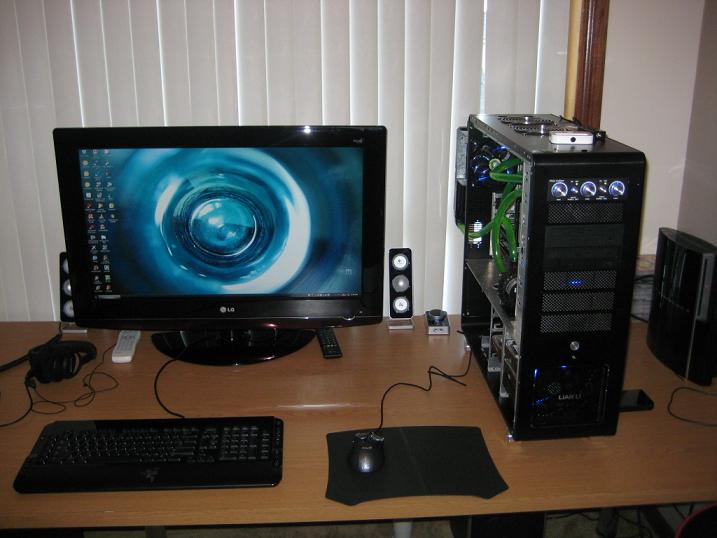
Identify the location of computer. Image resolution: width=717 pixels, height=538 pixels. (569, 276).